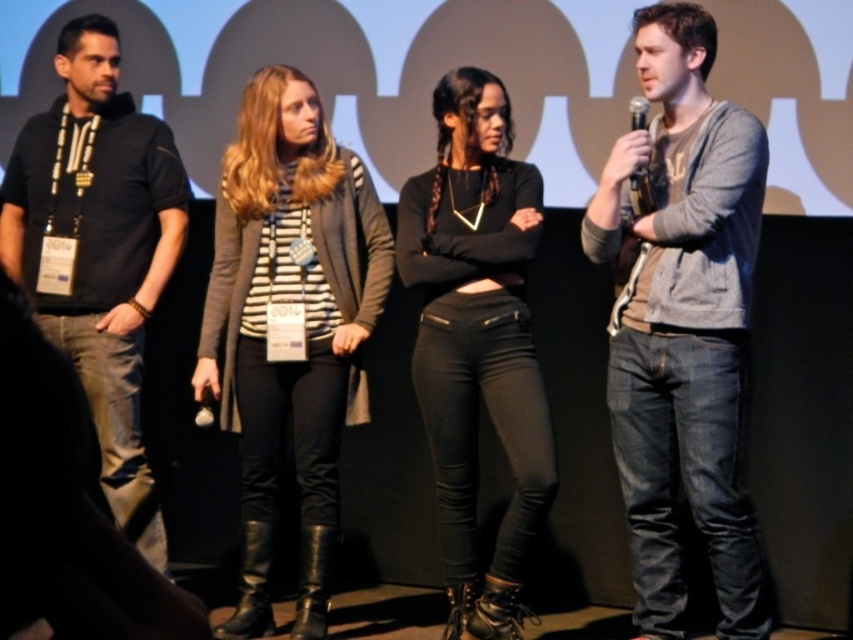
Question: Is gray cotton sweater at right to the left of striped knit sweater at center from the viewer's perspective?

Choices:
 (A) yes
 (B) no

Answer: (B)

Question: Is gray cotton sweater at right to the right of striped knit sweater at center from the viewer's perspective?

Choices:
 (A) yes
 (B) no

Answer: (A)

Question: Which object is the farthest from the black cotton polo shirt at left?

Choices:
 (A) black plastic microphone at right
 (B) striped knit sweater at center
 (C) black leather pants at center
 (D) gray cotton sweater at right

Answer: (A)

Question: Does gray cotton sweater at right have a lesser width compared to black leather pants at center?

Choices:
 (A) yes
 (B) no

Answer: (B)

Question: Estimate the real-world distances between objects in this image. Which object is farther from the striped knit sweater at center?

Choices:
 (A) black plastic microphone at right
 (B) black cotton polo shirt at left
 (C) gray cotton sweater at right

Answer: (A)

Question: Considering the real-world distances, which object is closest to the black cotton polo shirt at left?

Choices:
 (A) black leather pants at center
 (B) striped knit sweater at center

Answer: (B)